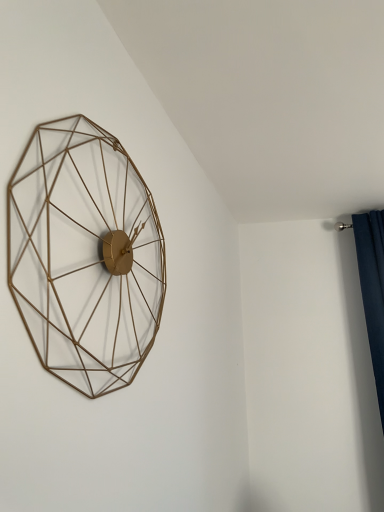
Question: Is dark blue fabric at right located within gold wire wall clock at left?

Choices:
 (A) yes
 (B) no

Answer: (B)

Question: Is gold wire wall clock at left wider than dark blue fabric at right?

Choices:
 (A) yes
 (B) no

Answer: (B)

Question: Is gold wire wall clock at left positioned far away from dark blue fabric at right?

Choices:
 (A) no
 (B) yes

Answer: (B)

Question: Does gold wire wall clock at left come behind dark blue fabric at right?

Choices:
 (A) yes
 (B) no

Answer: (B)

Question: Does gold wire wall clock at left come in front of dark blue fabric at right?

Choices:
 (A) no
 (B) yes

Answer: (B)

Question: Is dark blue fabric at right at the back of gold wire wall clock at left?

Choices:
 (A) no
 (B) yes

Answer: (A)

Question: Can you confirm if dark blue fabric at right is bigger than gold wire wall clock at left?

Choices:
 (A) no
 (B) yes

Answer: (B)

Question: From a real-world perspective, is dark blue fabric at right on gold wire wall clock at left?

Choices:
 (A) yes
 (B) no

Answer: (B)

Question: Is dark blue fabric at right positioned with its back to gold wire wall clock at left?

Choices:
 (A) yes
 (B) no

Answer: (B)

Question: Can you confirm if dark blue fabric at right is positioned to the right of gold wire wall clock at left?

Choices:
 (A) no
 (B) yes

Answer: (B)

Question: Can you confirm if dark blue fabric at right is taller than gold wire wall clock at left?

Choices:
 (A) no
 (B) yes

Answer: (B)

Question: Can you confirm if dark blue fabric at right is wider than gold wire wall clock at left?

Choices:
 (A) no
 (B) yes

Answer: (B)

Question: Considering their positions, is gold wire wall clock at left located in front of or behind dark blue fabric at right?

Choices:
 (A) front
 (B) behind

Answer: (A)